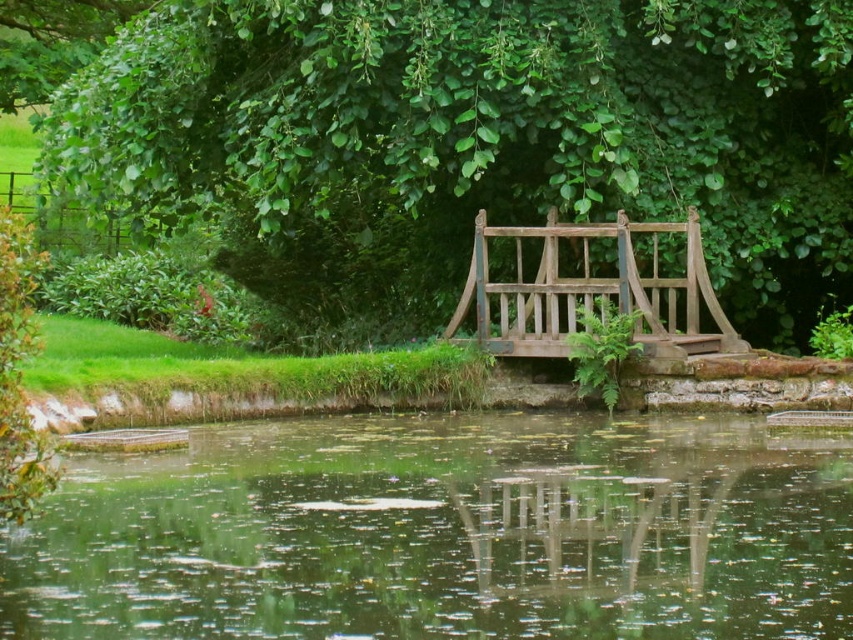
You are a painter wanting to capture the scene of the green reflective water at center and the wooden park bench at center. Which object is lower in height?

The green reflective water at center has a lesser height compared to the wooden park bench at center, so the green reflective water at center is lower in height.

You are standing on the wooden park bench at center and want to see the view of the green leafy tree at center. Since the bench is behind the tree, can you still see the tree from your position?

The wooden park bench at center is behind the green leafy tree at center, so you cannot see the tree from your current position on the bench.

You are a painter standing at the edge of the water and want to paint the green leafy tree at center and the wooden park bench at center. Which object should you focus on first if you want to paint the taller one?

The green leafy tree at center is taller than the wooden park bench at center, so you should focus on painting the green leafy tree at center first.